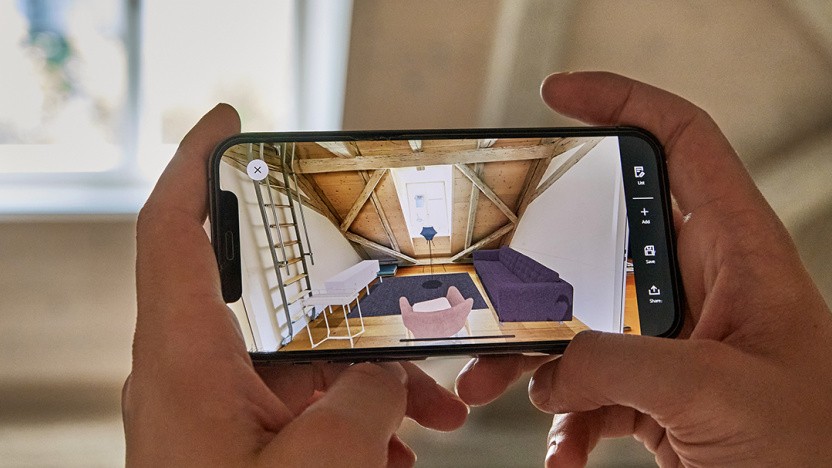
This screenshot has width=832, height=468. What are the coordinates of `window` in the screenshot? It's located at (83, 71).